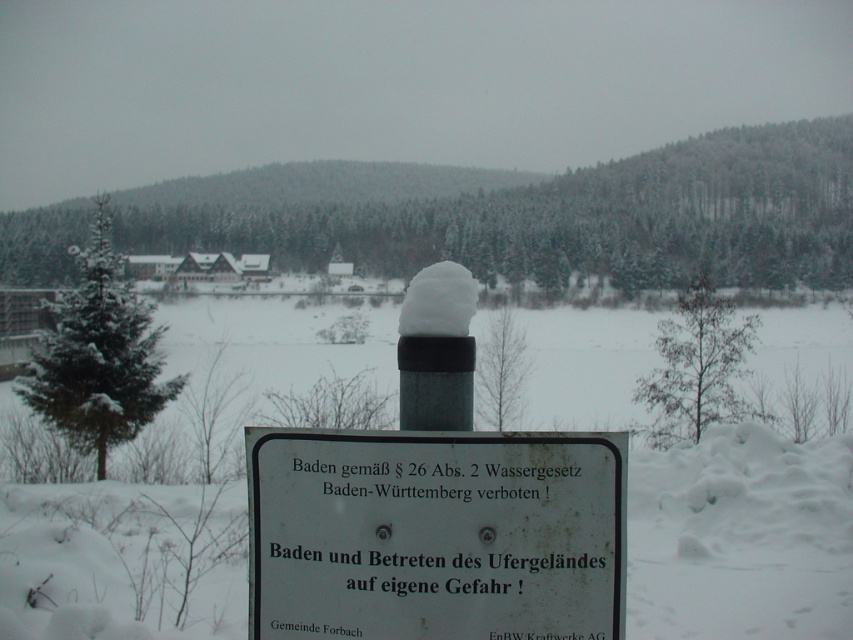
Between white plastic sign at center and white fluffy snow at center, which one appears on the right side from the viewer's perspective?

Positioned to the right is white fluffy snow at center.

Which is below, white plastic sign at center or white fluffy snow at center?

white plastic sign at center is lower down.

Is point (524, 557) closer to camera compared to point (418, 291)?

Yes, it is in front of point (418, 291).

Find the location of a particular element. This screenshot has height=640, width=853. white plastic sign at center is located at coordinates pos(434,534).